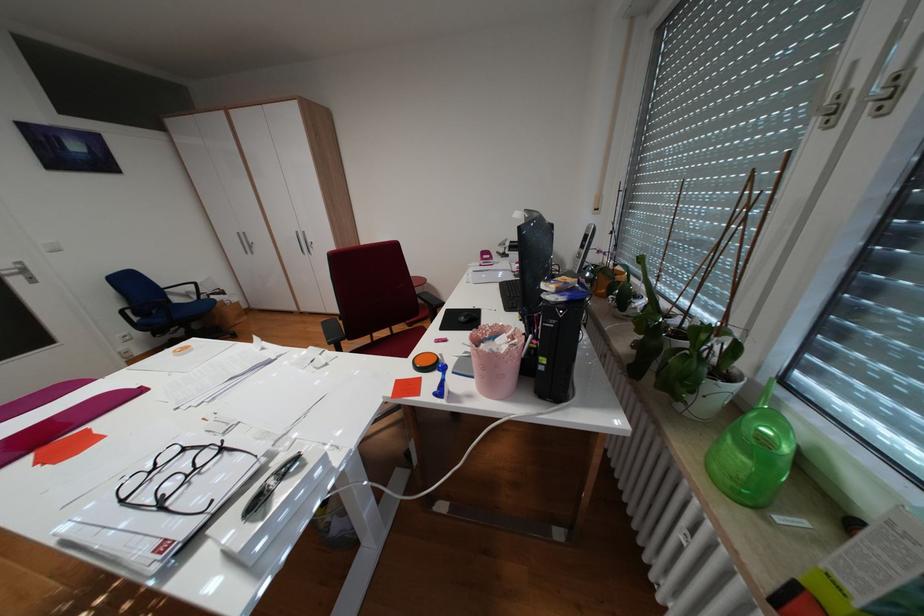
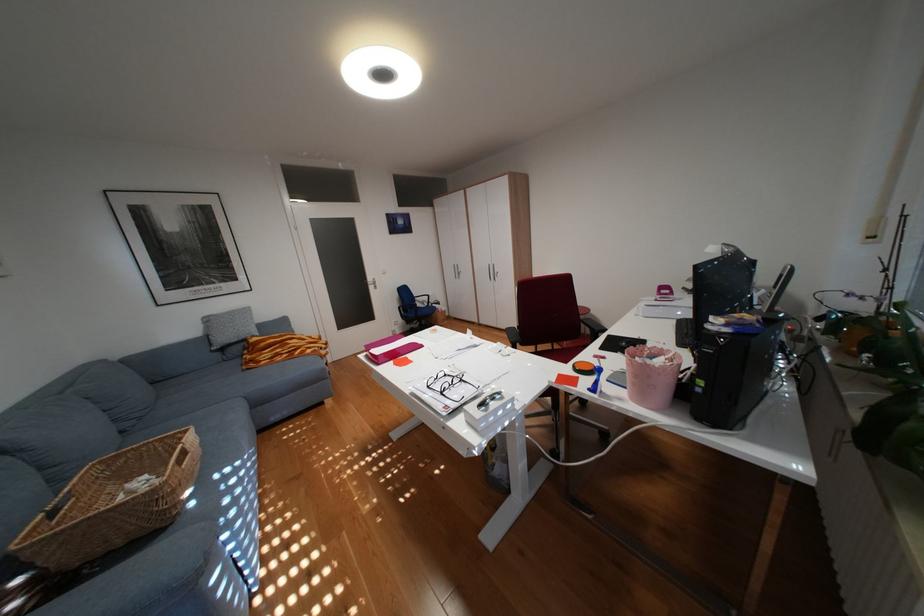
Where in the second image is the point corresponding to (322,352) from the first image?

(512, 345)